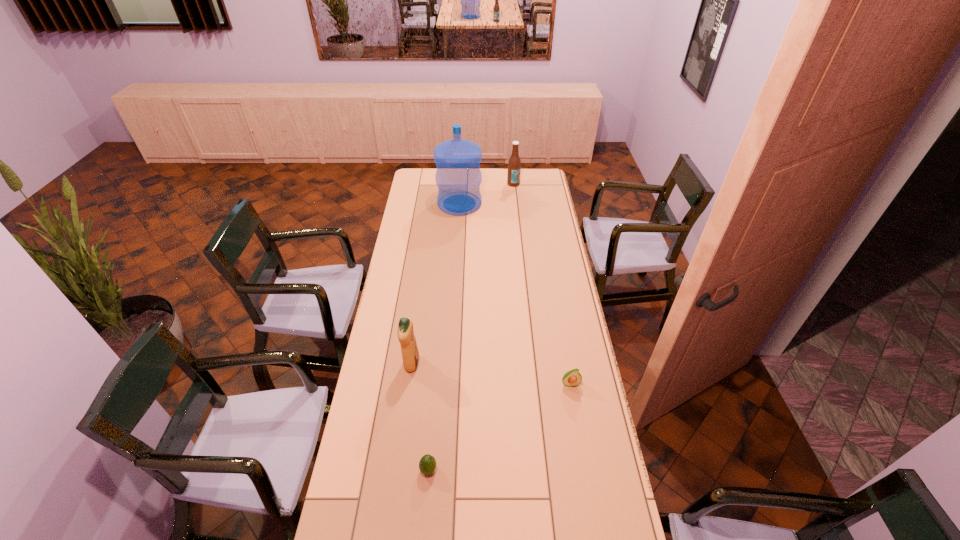
This screenshot has width=960, height=540. Identify the location of object that is the third nearest to the taller avocado. (458, 177).

This screenshot has width=960, height=540. Find the location of `free location that satisfies the following two spatial constraints: 1. on the front side of the second object from right to left; 2. on the label of the detergent`. free location that satisfies the following two spatial constraints: 1. on the front side of the second object from right to left; 2. on the label of the detergent is located at coordinates (532, 364).

What are the coordinates of `vacant position in the image that satisfies the following two spatial constraints: 1. on the label of the shorter avocado; 2. on the right side of the third farthest object` in the screenshot? It's located at (397, 469).